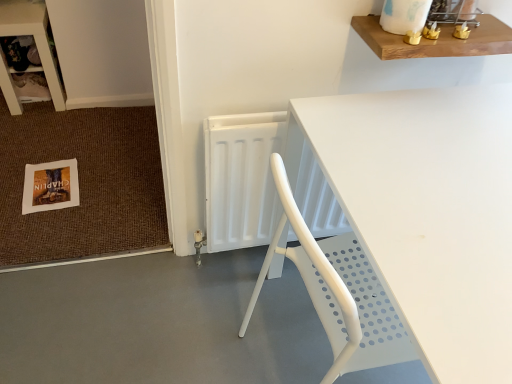
I want to click on vacant space in white paper postcard at lower left (from a real-world perspective), so click(x=53, y=183).